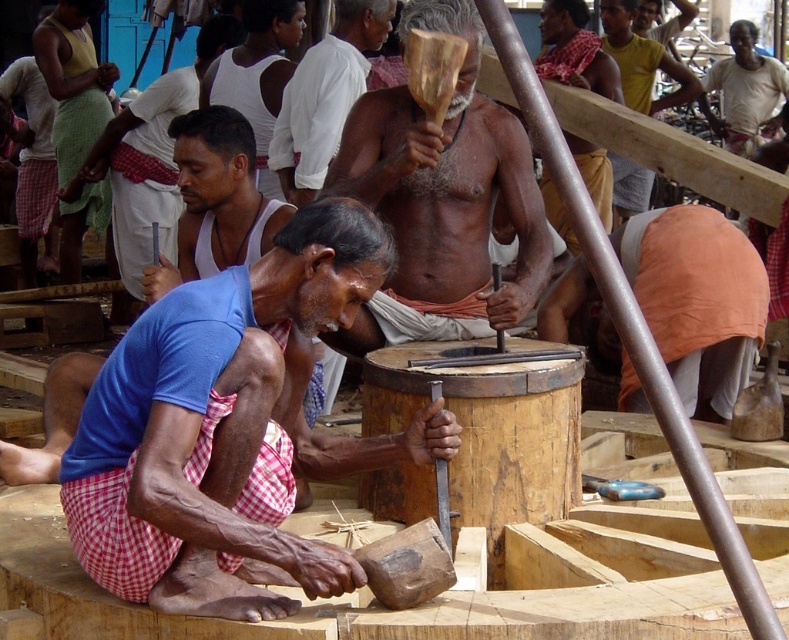
You are standing at point (70, 259) and want to reach point 0.623, 0.345. Given that the distance between these two points is 23.14 meters, can you walk directly to your destination without any obstacles?

The distance between point (70, 259) and point 0.623, 0.345 is 23.14 meters. Since there is no mention of obstacles in the scene description, you can walk directly to the destination.